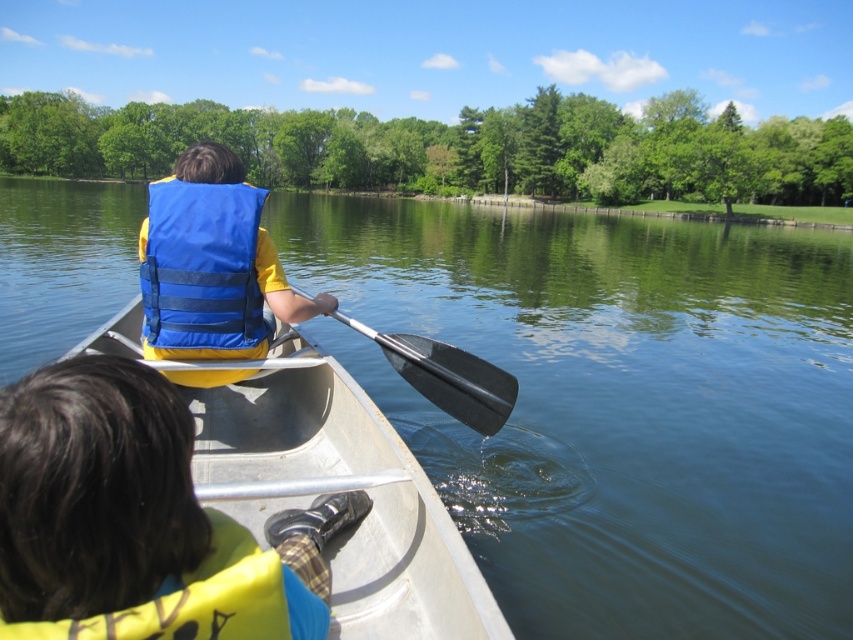
Question: Which object is closer to the camera taking this photo?

Choices:
 (A) blue fabric life jacket at center
 (B) clear blue water at center
 (C) yellow fabric life vest at center
 (D) black rubber paddle at center

Answer: (C)

Question: Is blue fabric life jacket at center behind yellow fleece life jacket at lower left?

Choices:
 (A) yes
 (B) no

Answer: (A)

Question: Does yellow fabric life vest at center have a lesser width compared to black rubber paddle at center?

Choices:
 (A) no
 (B) yes

Answer: (B)

Question: Which object is positioned farthest from the blue fabric life jacket at center?

Choices:
 (A) yellow fleece life jacket at lower left
 (B) clear blue water at center
 (C) black rubber paddle at center

Answer: (B)

Question: Is yellow fabric life vest at center smaller than blue fabric life jacket at center?

Choices:
 (A) no
 (B) yes

Answer: (B)

Question: Which is nearer to the black rubber paddle at center?

Choices:
 (A) yellow fleece life jacket at lower left
 (B) blue fabric life jacket at center
 (C) yellow fabric life vest at center
 (D) clear blue water at center

Answer: (B)